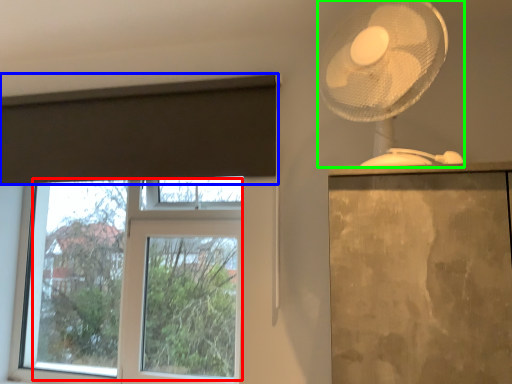
Question: Estimate the real-world distances between objects in this image. Which object is farther from bay window (highlighted by a red box), curtain (highlighted by a blue box) or mechanical fan (highlighted by a green box)?

Choices:
 (A) curtain
 (B) mechanical fan

Answer: (B)